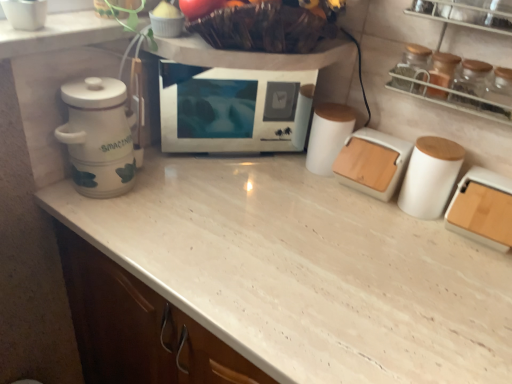
The width and height of the screenshot is (512, 384). What are the coordinates of `vacant area to the left of wooden lid container at right, which is the third kitchen appliance from left to right` in the screenshot? It's located at (397, 243).